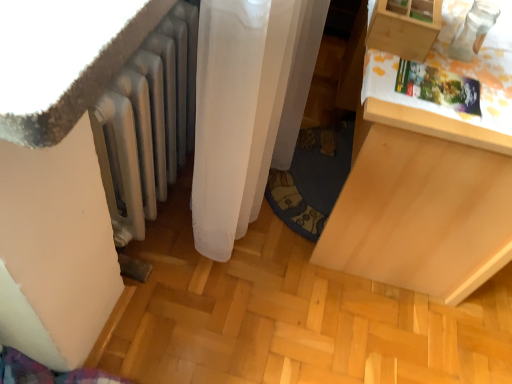
Question: Is silver metallic radiator at lower left closer to camera compared to wooden drawer at upper right?

Choices:
 (A) no
 (B) yes

Answer: (B)

Question: Is silver metallic radiator at lower left smaller than wooden drawer at upper right?

Choices:
 (A) no
 (B) yes

Answer: (A)

Question: Does silver metallic radiator at lower left have a greater height compared to wooden drawer at upper right?

Choices:
 (A) yes
 (B) no

Answer: (A)

Question: Does silver metallic radiator at lower left touch wooden drawer at upper right?

Choices:
 (A) no
 (B) yes

Answer: (A)

Question: Does silver metallic radiator at lower left have a larger size compared to wooden drawer at upper right?

Choices:
 (A) yes
 (B) no

Answer: (A)

Question: From the image's perspective, is light wood drawer at right positioned above or below wooden drawer at upper right?

Choices:
 (A) above
 (B) below

Answer: (B)

Question: In terms of size, does light wood drawer at right appear bigger or smaller than wooden drawer at upper right?

Choices:
 (A) big
 (B) small

Answer: (A)

Question: From a real-world perspective, is light wood drawer at right positioned above or below wooden drawer at upper right?

Choices:
 (A) below
 (B) above

Answer: (A)

Question: In the image, is light wood drawer at right positioned in front of or behind wooden drawer at upper right?

Choices:
 (A) front
 (B) behind

Answer: (A)

Question: Relative to silver metallic radiator at lower left, is wooden drawer at upper right in front or behind?

Choices:
 (A) behind
 (B) front

Answer: (A)

Question: From a real-world perspective, is wooden drawer at upper right positioned above or below silver metallic radiator at lower left?

Choices:
 (A) below
 (B) above

Answer: (B)

Question: In the image, is wooden drawer at upper right on the left side or the right side of silver metallic radiator at lower left?

Choices:
 (A) right
 (B) left

Answer: (A)

Question: Is wooden drawer at upper right inside or outside of silver metallic radiator at lower left?

Choices:
 (A) outside
 (B) inside

Answer: (A)

Question: Considering the positions of light wood drawer at right and silver metallic radiator at lower left in the image, is light wood drawer at right taller or shorter than silver metallic radiator at lower left?

Choices:
 (A) tall
 (B) short

Answer: (A)

Question: Is light wood drawer at right in front of or behind silver metallic radiator at lower left in the image?

Choices:
 (A) front
 (B) behind

Answer: (B)